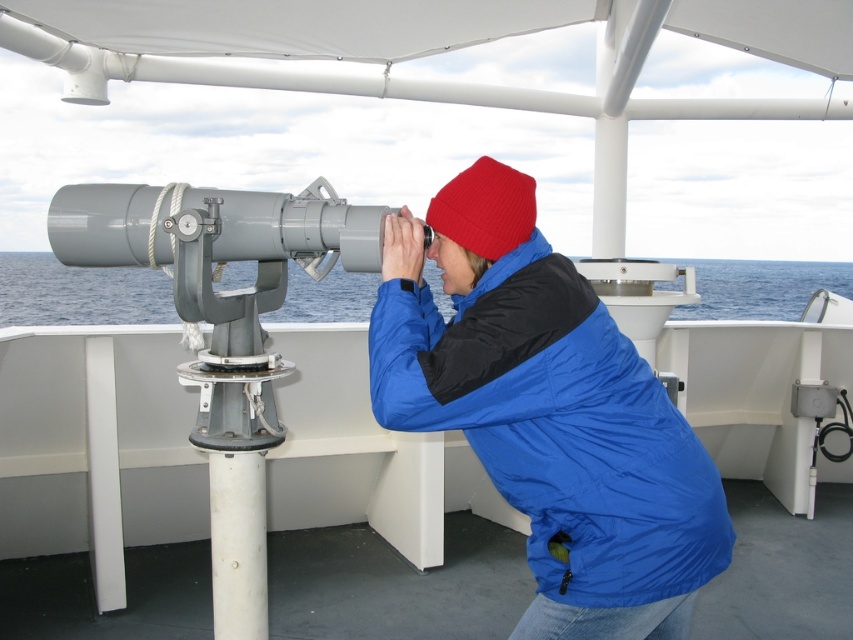
Question: Is blue water at center below red knit beanie at center?

Choices:
 (A) yes
 (B) no

Answer: (B)

Question: Where is blue water at center located in relation to red knit beanie at center in the image?

Choices:
 (A) right
 (B) left

Answer: (B)

Question: Among these objects, which one is nearest to the camera?

Choices:
 (A) red knit beanie at center
 (B) blue synthetic jacket at center

Answer: (B)

Question: Which is farther from the blue water at center?

Choices:
 (A) blue synthetic jacket at center
 (B) red knit beanie at center

Answer: (B)

Question: Does blue water at center appear under red knit beanie at center?

Choices:
 (A) no
 (B) yes

Answer: (A)

Question: Which object appears farthest from the camera in this image?

Choices:
 (A) red knit beanie at center
 (B) blue synthetic jacket at center
 (C) blue water at center

Answer: (C)